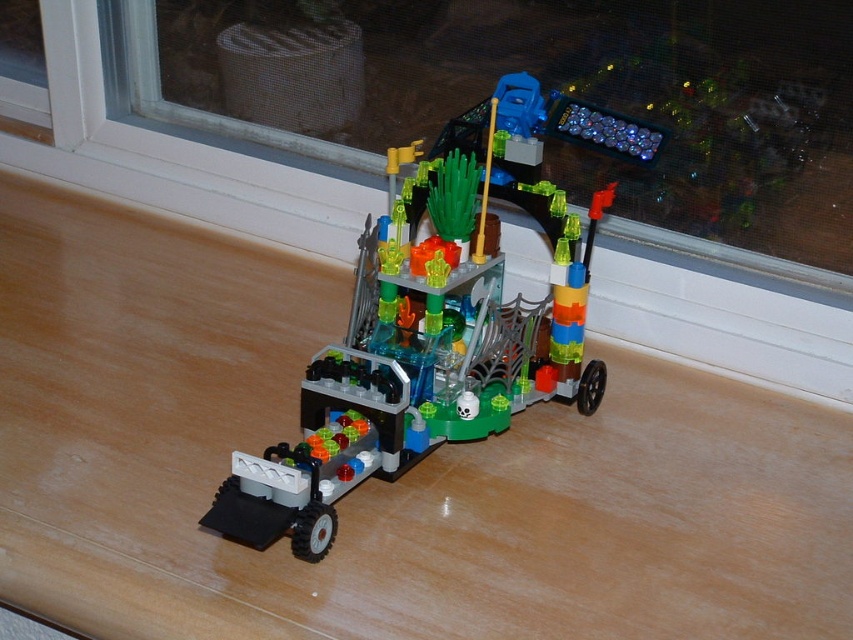
Question: Which of the following is the closest to the observer?

Choices:
 (A) (720, 248)
 (B) (602, 374)

Answer: (B)

Question: Does translucent plastic vehicle at center have a greater width compared to transparent glass window at upper center?

Choices:
 (A) no
 (B) yes

Answer: (A)

Question: From the image, what is the correct spatial relationship of translucent plastic vehicle at center in relation to transparent glass window at upper center?

Choices:
 (A) above
 (B) below

Answer: (B)

Question: Among these objects, which one is farthest from the camera?

Choices:
 (A) translucent plastic vehicle at center
 (B) transparent glass window at upper center

Answer: (B)

Question: Is translucent plastic vehicle at center thinner than transparent glass window at upper center?

Choices:
 (A) yes
 (B) no

Answer: (A)